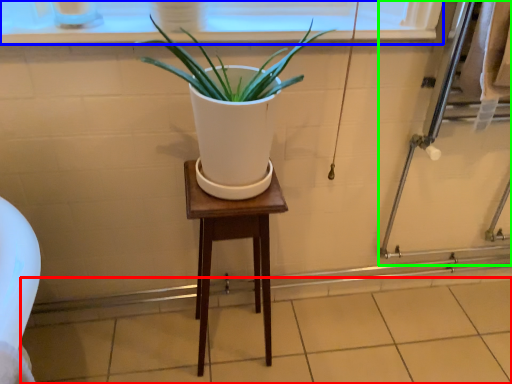
Question: Based on their relative distances, which object is farther from tile (highlighted by a red box)? Choose from window frame (highlighted by a blue box) and screen door (highlighted by a green box).

Choices:
 (A) window frame
 (B) screen door

Answer: (A)